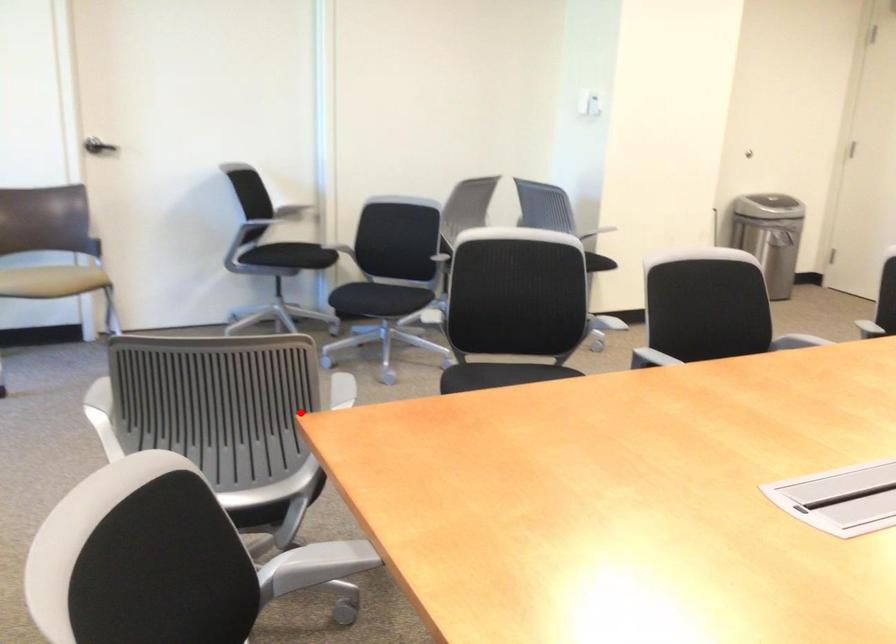
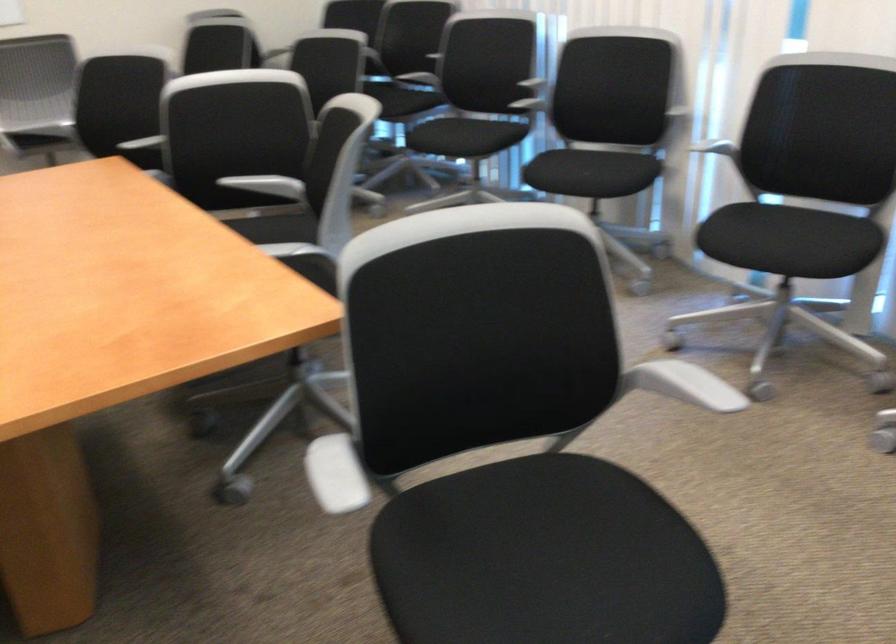
The point at the highlighted location is marked in the first image. Where is the corresponding point in the second image?

(334, 474)